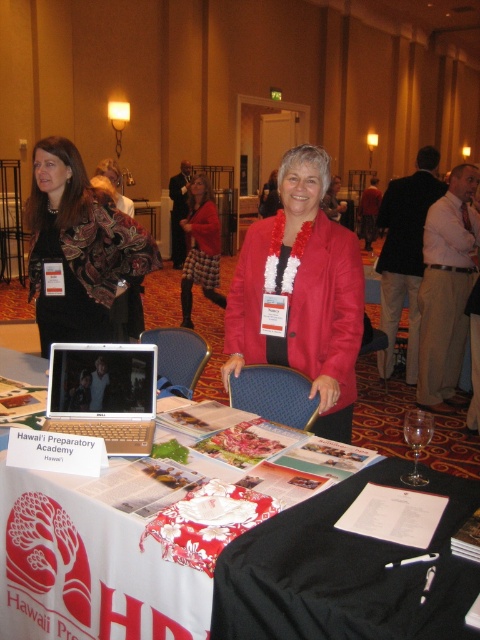
Can you confirm if silver metallic laptop at center is wider than clear glass wine glass at center?

Indeed, silver metallic laptop at center has a greater width compared to clear glass wine glass at center.

Is point (60, 403) in front of point (410, 429)?

No.

What do you see at coordinates (104, 394) in the screenshot? The width and height of the screenshot is (480, 640). I see `silver metallic laptop at center` at bounding box center [104, 394].

Locate an element on the screen. silver metallic laptop at center is located at coordinates (104, 394).

Does matte black scarf at upper left have a smaller size compared to silver metallic laptop at center?

No, matte black scarf at upper left is not smaller than silver metallic laptop at center.

Does matte black scarf at upper left have a lesser height compared to silver metallic laptop at center?

No.

Locate an element on the screen. matte black scarf at upper left is located at coordinates (81, 250).

What are the coordinates of `matte black scarf at upper left` in the screenshot? It's located at (81, 250).

Can you confirm if white paper at center is bigger than red plaid skirt at center?

Incorrect, white paper at center is not larger than red plaid skirt at center.

Is white paper at center positioned in front of red plaid skirt at center?

Yes.

Is point (68, 573) positioned before point (200, 262)?

Yes, point (68, 573) is in front of point (200, 262).

This screenshot has height=640, width=480. In order to click on white paper at center in this screenshot , I will do tap(87, 566).